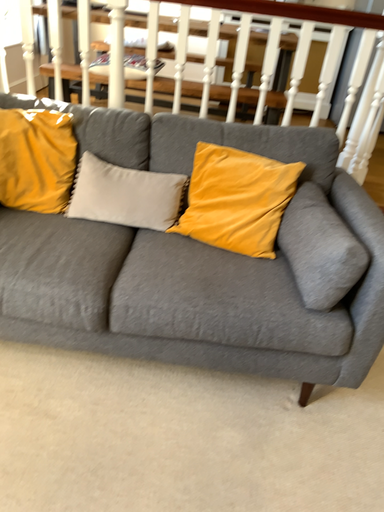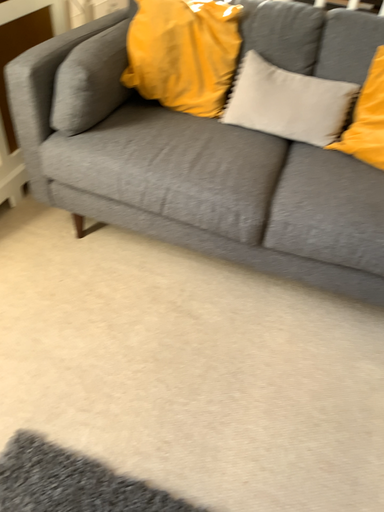
Question: Which way did the camera rotate in the video?

Choices:
 (A) rotated downward
 (B) rotated upward

Answer: (A)